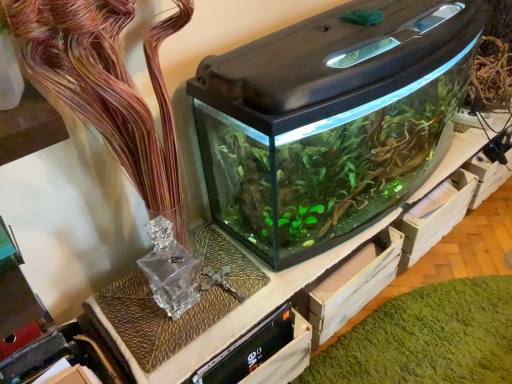
Question: Should I look upward or downward to see transparent glass aquarium at center?

Choices:
 (A) up
 (B) down

Answer: (A)

Question: Can you confirm if green matte algae at center is thinner than transparent glass aquarium at center?

Choices:
 (A) yes
 (B) no

Answer: (B)

Question: From the image's perspective, would you say green matte algae at center is shown under transparent glass aquarium at center?

Choices:
 (A) yes
 (B) no

Answer: (A)

Question: From the image's perspective, is green matte algae at center on top of transparent glass aquarium at center?

Choices:
 (A) no
 (B) yes

Answer: (A)

Question: Is green matte algae at center further to the viewer compared to transparent glass aquarium at center?

Choices:
 (A) no
 (B) yes

Answer: (B)

Question: From a real-world perspective, does green matte algae at center sit lower than transparent glass aquarium at center?

Choices:
 (A) yes
 (B) no

Answer: (A)

Question: Is green matte algae at center positioned with its back to transparent glass aquarium at center?

Choices:
 (A) no
 (B) yes

Answer: (A)

Question: Can you confirm if translucent glass vase at upper center is wider than transparent glass aquarium at center?

Choices:
 (A) yes
 (B) no

Answer: (B)

Question: From a real-world perspective, is translucent glass vase at upper center under transparent glass aquarium at center?

Choices:
 (A) yes
 (B) no

Answer: (B)

Question: Does translucent glass vase at upper center have a greater height compared to transparent glass aquarium at center?

Choices:
 (A) yes
 (B) no

Answer: (A)

Question: Does translucent glass vase at upper center lie behind transparent glass aquarium at center?

Choices:
 (A) no
 (B) yes

Answer: (A)

Question: Can you confirm if translucent glass vase at upper center is positioned to the right of transparent glass aquarium at center?

Choices:
 (A) yes
 (B) no

Answer: (B)

Question: Does translucent glass vase at upper center turn towards transparent glass aquarium at center?

Choices:
 (A) yes
 (B) no

Answer: (B)

Question: Does translucent glass vase at upper center have a greater width compared to green matte algae at center?

Choices:
 (A) yes
 (B) no

Answer: (B)